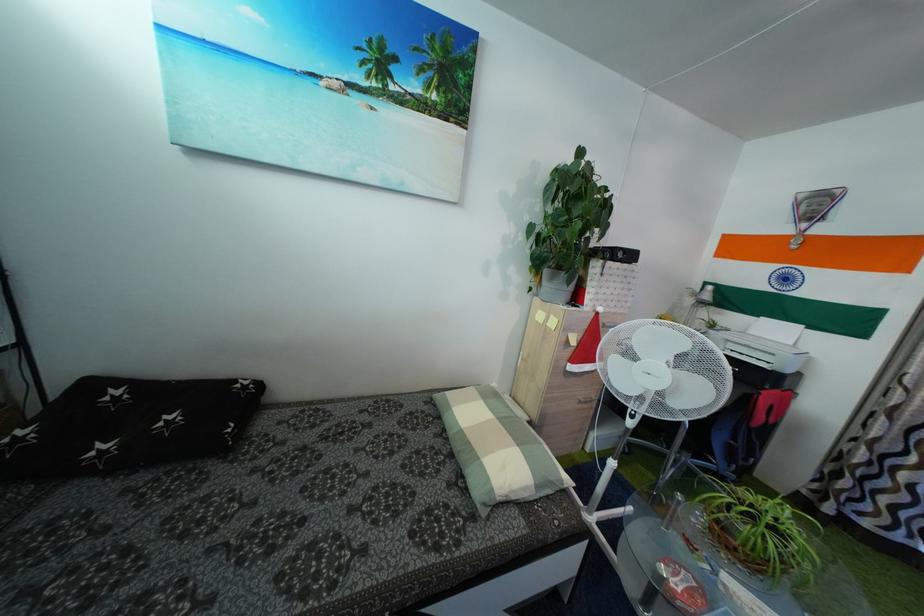
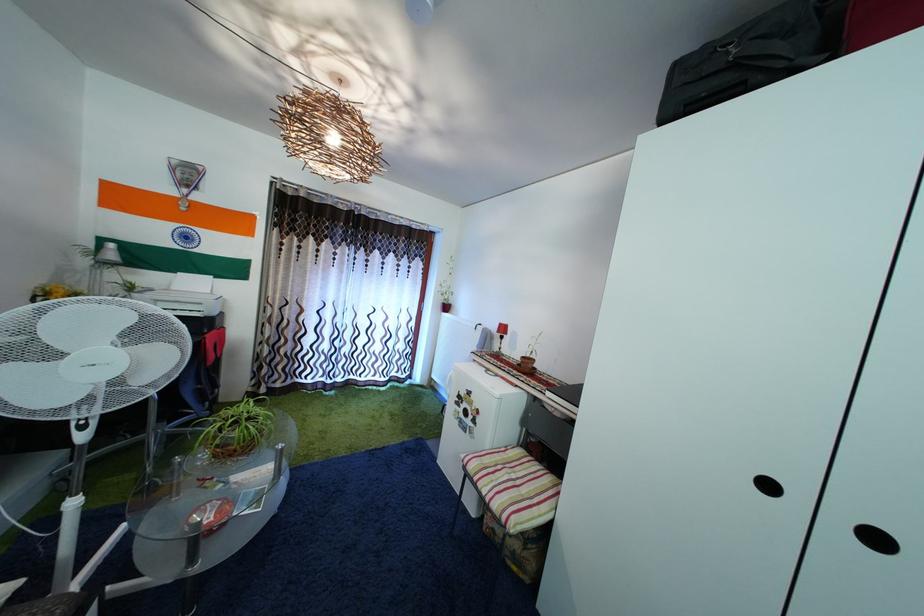
Based on the continuous images, in which direction is the camera rotating?

The camera's rotation is toward right-down.